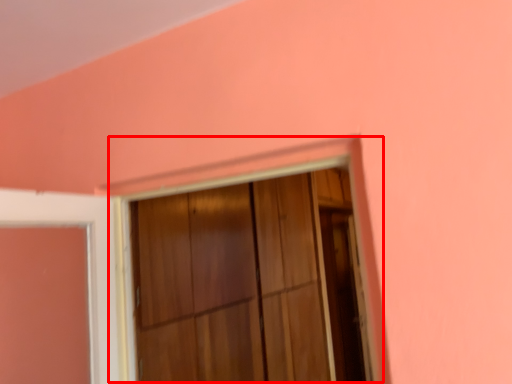
Question: From the image's perspective, where is window frame (annotated by the red box) located in relation to screen door in the image?

Choices:
 (A) above
 (B) below

Answer: (A)